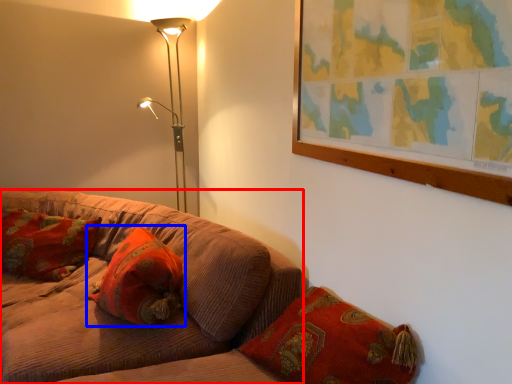
Question: Which of the following is the closest to the observer, studio couch (highlighted by a red box) or pillow (highlighted by a blue box)?

Choices:
 (A) studio couch
 (B) pillow

Answer: (A)